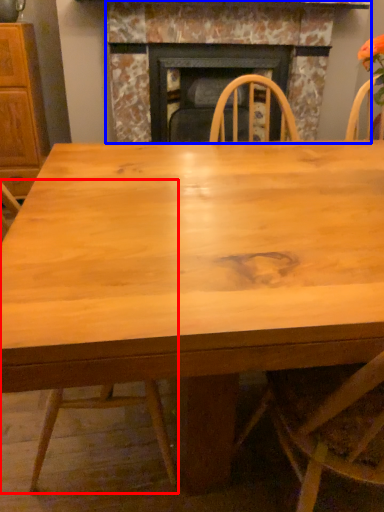
Question: Which object appears farthest to the camera in this image, chair (highlighted by a red box) or fireplace (highlighted by a blue box)?

Choices:
 (A) chair
 (B) fireplace

Answer: (B)